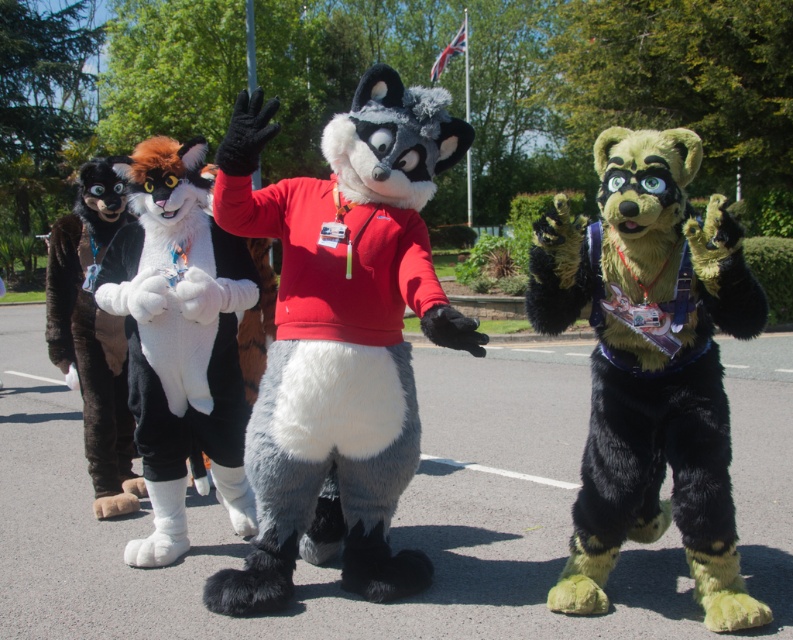
Question: Is fluffy green fur at center closer to camera compared to white plush cat at center?

Choices:
 (A) no
 (B) yes

Answer: (B)

Question: Which point appears farthest from the camera in this image?

Choices:
 (A) (652, 456)
 (B) (236, 438)

Answer: (B)

Question: Is fluffy green fur at center positioned before white plush cat at center?

Choices:
 (A) no
 (B) yes

Answer: (B)

Question: Which object appears farthest from the camera in this image?

Choices:
 (A) fluffy green fur at center
 (B) white plush cat at center

Answer: (B)

Question: Does fluffy green fur at center appear under white plush cat at center?

Choices:
 (A) yes
 (B) no

Answer: (A)